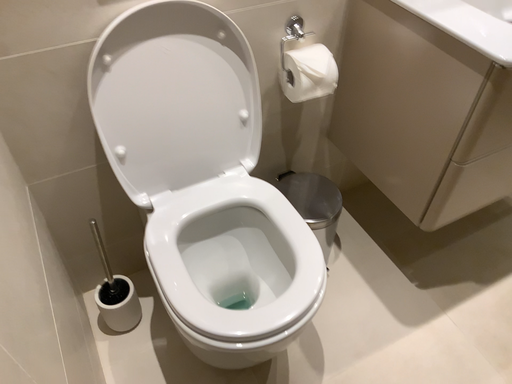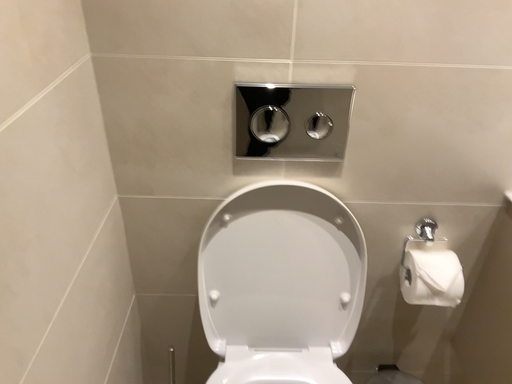
Question: How did the camera likely rotate when shooting the video?

Choices:
 (A) rotated downward
 (B) rotated upward

Answer: (B)